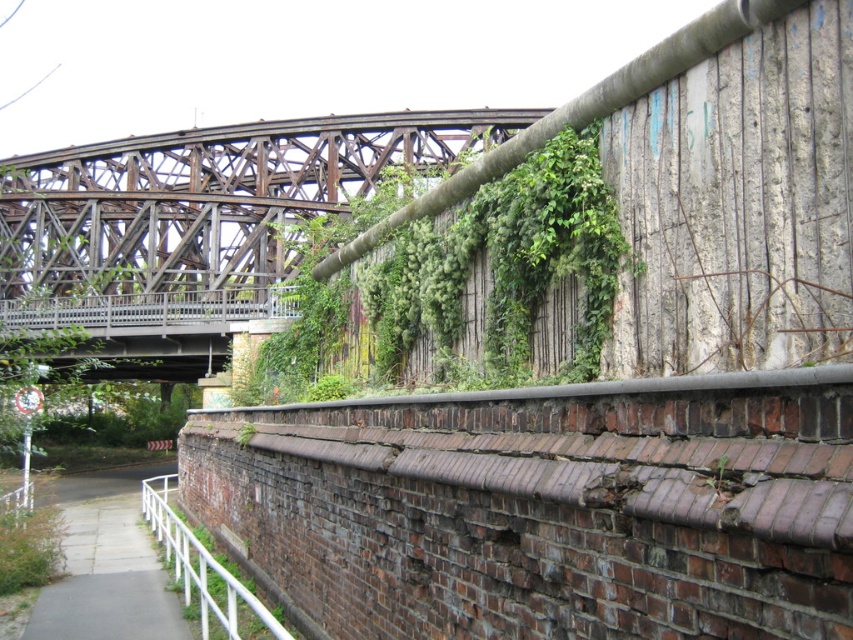
Can you confirm if gray concrete sidewalk at lower left is positioned to the right of white metal rail at lower left?

No, gray concrete sidewalk at lower left is not to the right of white metal rail at lower left.

Which of these two, gray concrete sidewalk at lower left or white metal rail at lower left, stands taller?

white metal rail at lower left

You are a GUI agent. You are given a task and a screenshot of the screen. Output one action in this format:
    pyautogui.click(x=<x>, y=<y>)
    Task: Click on the gray concrete sidewalk at lower left
    
    Given the screenshot: What is the action you would take?
    pyautogui.click(x=105, y=566)

Where is `gray concrete sidewalk at lower left`? This screenshot has height=640, width=853. gray concrete sidewalk at lower left is located at coordinates (x=105, y=566).